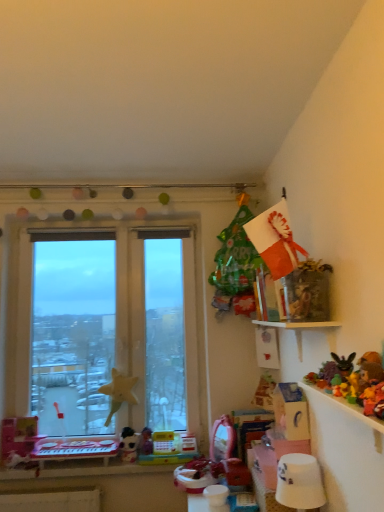
Locate an element on the screen. vacant region above white glossy lampshade at lower right (from a real-world perspective) is located at coordinates (298, 458).